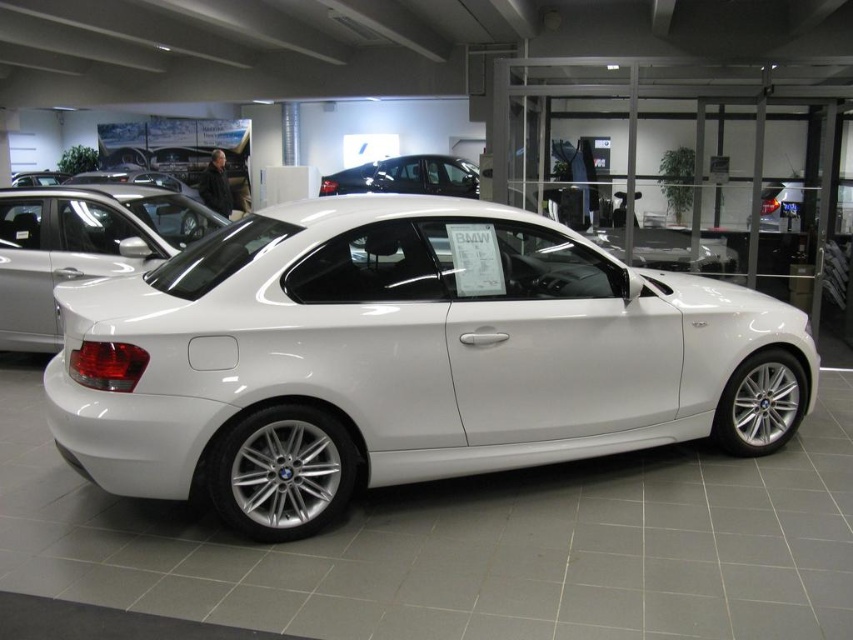
Question: Where is white glossy car at center located in relation to glossy black car at center in the image?

Choices:
 (A) below
 (B) above

Answer: (A)

Question: Among these objects, which one is nearest to the camera?

Choices:
 (A) white glossy car at center
 (B) white metallic car at center
 (C) glossy black car at center

Answer: (A)

Question: Is white metallic car at center wider than glossy black car at center?

Choices:
 (A) yes
 (B) no

Answer: (B)

Question: Among these points, which one is farthest from the camera?

Choices:
 (A) (115, 243)
 (B) (392, 172)

Answer: (B)

Question: Which of the following is the closest to the observer?

Choices:
 (A) white metallic car at center
 (B) white glossy car at center
 (C) glossy black car at center

Answer: (B)

Question: Is white glossy car at center thinner than white metallic car at center?

Choices:
 (A) no
 (B) yes

Answer: (A)